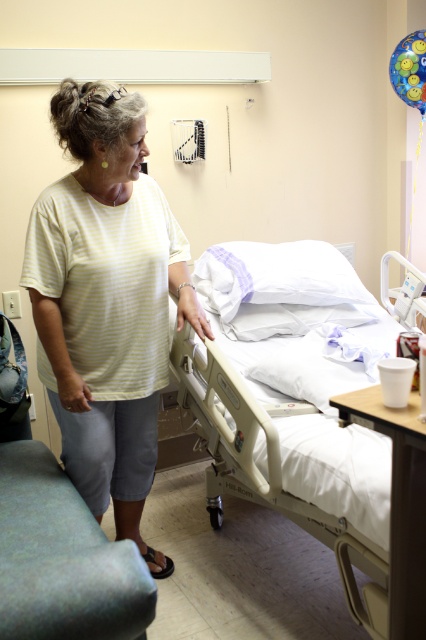
You are a nurse in a hospital room and need to locate the patient wearing the yellow striped shirt at center. According to the coordinates provided, where should you look to find the patient?

The patient wearing the yellow striped shirt at center is located at coordinates point (106, 301).

You are a nurse entering the hospital room and need to approach the beige plastic hospital bed at center. Which side of the yellow striped shirt at center should you walk around to reach the bed?

You should walk around the right side of the yellow striped shirt at center to reach the beige plastic hospital bed at center since the shirt is to the left of the bed.